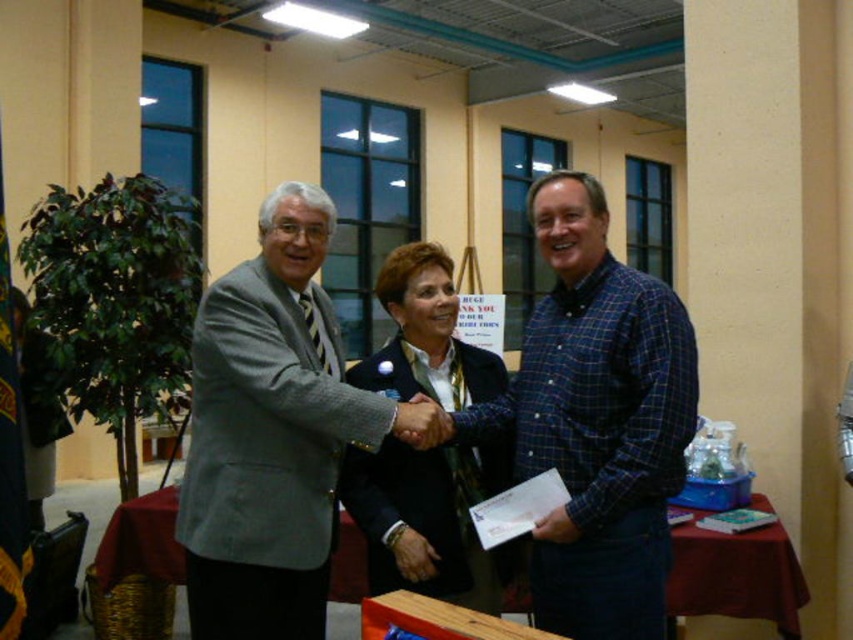
Question: Which is farther from the maroon fabric table at lower right?

Choices:
 (A) gray wool suit at center
 (B) wooden table at center

Answer: (A)

Question: Is gray wool suit at center in front of wooden table at center?

Choices:
 (A) yes
 (B) no

Answer: (A)

Question: Can you confirm if dark blue jacket at center is positioned above maroon fabric table at lower right?

Choices:
 (A) yes
 (B) no

Answer: (A)

Question: Which object is farther from the camera taking this photo?

Choices:
 (A) blue plaid shirt at center
 (B) gray wool suit at center

Answer: (B)

Question: Which point is farther to the camera?

Choices:
 (A) (445, 301)
 (B) (759, 579)
 (C) (120, 515)
 (D) (329, 412)

Answer: (C)

Question: Is gray wool suit at center below maroon fabric table at lower right?

Choices:
 (A) yes
 (B) no

Answer: (B)